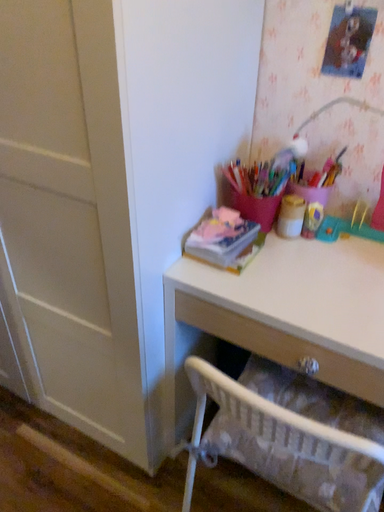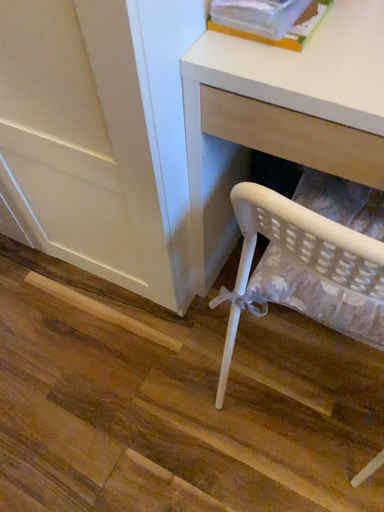
Question: Which way did the camera rotate in the video?

Choices:
 (A) rotated downward
 (B) rotated upward

Answer: (A)